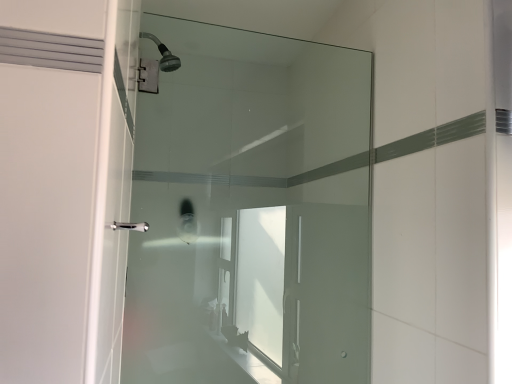
Describe the element at coordinates (251, 212) in the screenshot. I see `clear glass mirror at center` at that location.

What is the approximate width of clear glass mirror at center?

5.11 centimeters.

Where is `clear glass mirror at center`? Image resolution: width=512 pixels, height=384 pixels. clear glass mirror at center is located at coordinates (251, 212).

This screenshot has height=384, width=512. In order to click on clear glass mirror at center in this screenshot , I will do `click(251, 212)`.